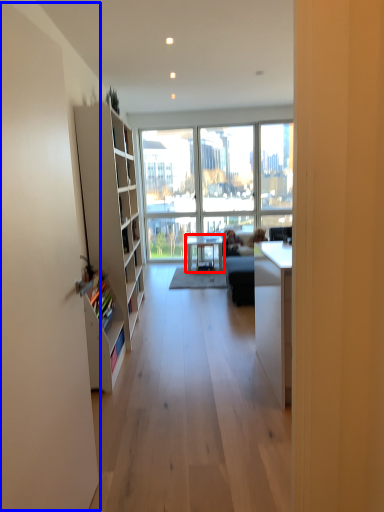
Question: Which object is further to the camera taking this photo, table (highlighted by a red box) or screen door (highlighted by a blue box)?

Choices:
 (A) table
 (B) screen door

Answer: (A)